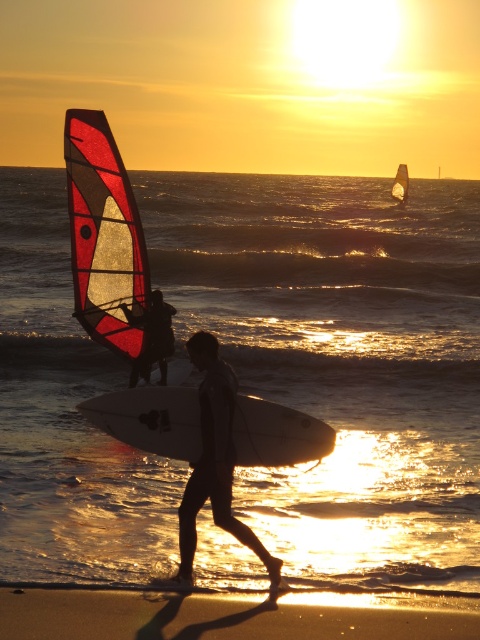
You are a photographer trying to capture the sunset scene. You notice the white matte surfboard at center and the silhouette wetsuit at center. Which object is positioned to the right side of the other?

The white matte surfboard at center is to the right of the silhouette wetsuit at center.

You are standing on the beach and see the point marked at coordinates (149,419). What object is located at that point?

The point at coordinates (149,419) corresponds to the white matte surfboard at center.

You are standing on the beach and see two points marked in the scene. The first point is at coordinates point (263, 428) and the second point is at point (404, 173). Which point is closer to you?

Point (263, 428) is in front of point (404, 173), so it is closer to you.